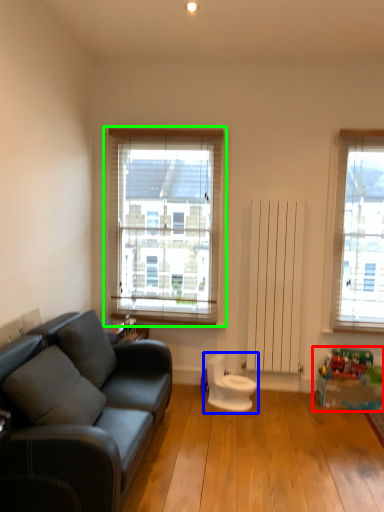
Question: Based on their relative distances, which object is nearer to toy (highlighted by a red box)? Choose from swivel chair (highlighted by a blue box) and window (highlighted by a green box).

Choices:
 (A) swivel chair
 (B) window

Answer: (A)